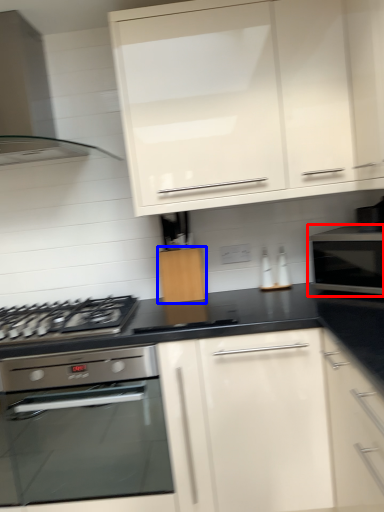
Question: Which object appears farthest to the camera in this image, microwave oven (highlighted by a red box) or cabinetry (highlighted by a blue box)?

Choices:
 (A) microwave oven
 (B) cabinetry

Answer: (B)